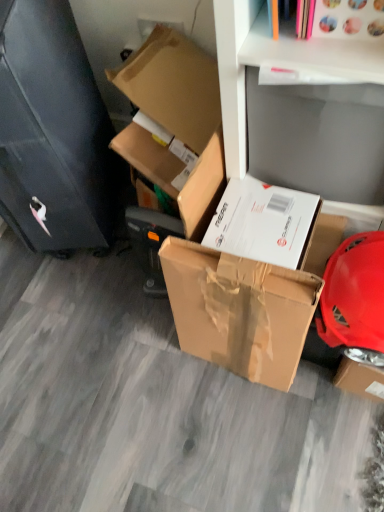
The width and height of the screenshot is (384, 512). Find the location of `free point above brown cardboard box at center, which is the 1th box in bottom-to-top order (from a real-world perspective)`. free point above brown cardboard box at center, which is the 1th box in bottom-to-top order (from a real-world perspective) is located at coordinates (237, 267).